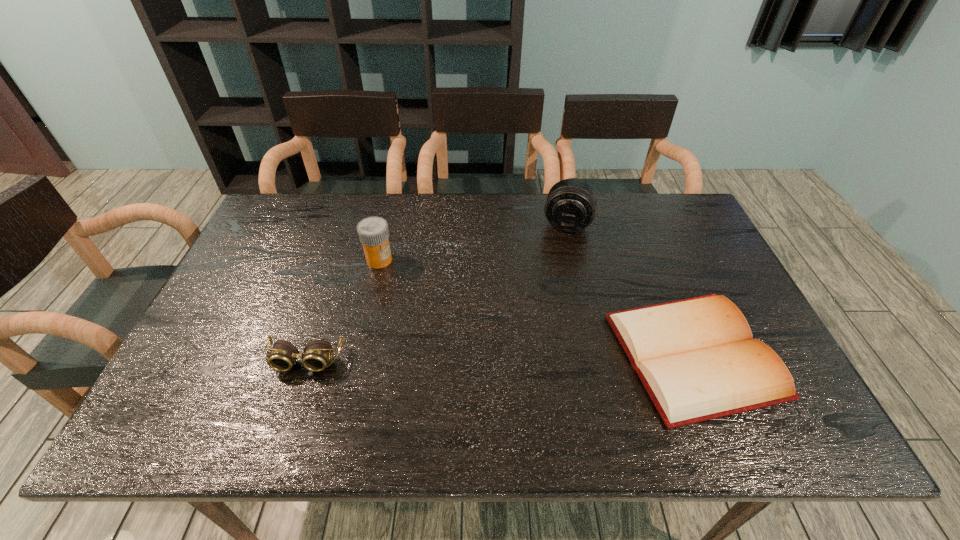
I want to click on the second shortest object, so (x=317, y=353).

Identify the location of Bible. pyautogui.click(x=696, y=358).

Identify the location of the third shortest object. (373, 232).

The height and width of the screenshot is (540, 960). I want to click on the second farthest object, so click(373, 232).

You are a GUI agent. You are given a task and a screenshot of the screen. Output one action in this format:
    pyautogui.click(x=<x>, y=<y>)
    Task: Click on the farthest object
    The height and width of the screenshot is (540, 960).
    Given the screenshot: What is the action you would take?
    pyautogui.click(x=570, y=207)

Identify the location of the tallest object. Image resolution: width=960 pixels, height=540 pixels. (570, 207).

At what (x,y) coordinates should I click in order to perform the action: click on vacant space situated on the left of the shortest object. Please return your answer as a coordinate pair (x, y). Image resolution: width=960 pixels, height=540 pixels. Looking at the image, I should click on (498, 355).

The height and width of the screenshot is (540, 960). What are the coordinates of `free location located 0.200m on the label side of the second tallest object` in the screenshot? It's located at (416, 313).

Where is `vacant point located 0.150m on the label side of the second tallest object`? The image size is (960, 540). vacant point located 0.150m on the label side of the second tallest object is located at coordinates (408, 301).

Locate an element on the screen. The image size is (960, 540). blank space located 0.210m on the label side of the second tallest object is located at coordinates (418, 315).